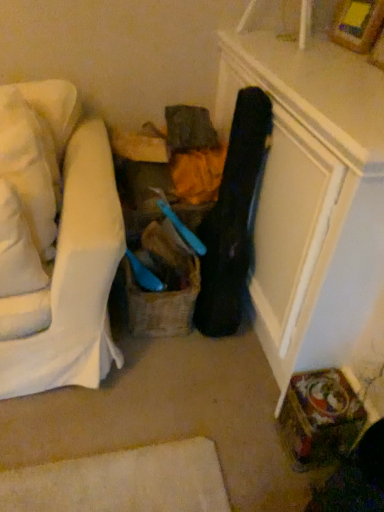
Question: Considering the relative sizes of white fabric pillow at left, which ranks as the second pillow in back-to-front order, and wooden picture frame at upper right in the image provided, is white fabric pillow at left, which ranks as the second pillow in back-to-front order, bigger than wooden picture frame at upper right?

Choices:
 (A) yes
 (B) no

Answer: (A)

Question: From a real-world perspective, is white fabric pillow at left, which ranks as the second pillow in back-to-front order, positioned under wooden picture frame at upper right based on gravity?

Choices:
 (A) no
 (B) yes

Answer: (B)

Question: Is white fabric pillow at left, which ranks as the second pillow in back-to-front order, taller than wooden picture frame at upper right?

Choices:
 (A) yes
 (B) no

Answer: (A)

Question: From the image's perspective, is white fabric pillow at left, arranged as the first pillow when viewed from the front, on wooden picture frame at upper right?

Choices:
 (A) yes
 (B) no

Answer: (B)

Question: Is wooden picture frame at upper right surrounded by white fabric pillow at left, which ranks as the second pillow in back-to-front order?

Choices:
 (A) no
 (B) yes

Answer: (A)

Question: Are white fabric pillow at left, which ranks as the second pillow in back-to-front order, and wooden picture frame at upper right beside each other?

Choices:
 (A) yes
 (B) no

Answer: (B)

Question: Is white fabric pillow at left, arranged as the first pillow when viewed from the front, not close to white soft pillow at left, placed as the 2th pillow when sorted from front to back?

Choices:
 (A) yes
 (B) no

Answer: (B)

Question: From the image's perspective, is white fabric pillow at left, arranged as the first pillow when viewed from the front, below white soft pillow at left, placed as the 2th pillow when sorted from front to back?

Choices:
 (A) no
 (B) yes

Answer: (B)

Question: From the image's perspective, is white fabric pillow at left, which ranks as the second pillow in back-to-front order, over white soft pillow at left, which is the 1th pillow from back to front?

Choices:
 (A) yes
 (B) no

Answer: (B)

Question: From a real-world perspective, is white fabric pillow at left, which ranks as the second pillow in back-to-front order, under white soft pillow at left, which is the 1th pillow from back to front?

Choices:
 (A) yes
 (B) no

Answer: (A)

Question: Is white soft pillow at left, placed as the 2th pillow when sorted from front to back, at the back of white fabric pillow at left, which ranks as the second pillow in back-to-front order?

Choices:
 (A) no
 (B) yes

Answer: (B)

Question: Does white fabric pillow at left, arranged as the first pillow when viewed from the front, appear on the left side of white soft pillow at left, placed as the 2th pillow when sorted from front to back?

Choices:
 (A) no
 (B) yes

Answer: (A)

Question: Is white fabric pillow at left, which ranks as the second pillow in back-to-front order, next to burlap basket at center and touching it?

Choices:
 (A) no
 (B) yes

Answer: (A)